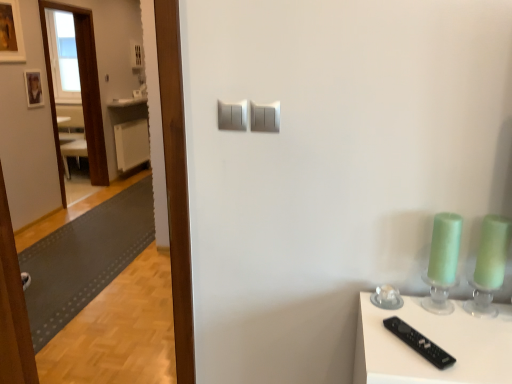
Question: Should I look upward or downward to see wooden picture frame at upper left, the 1th picture frame when ordered from front to back?

Choices:
 (A) down
 (B) up

Answer: (B)

Question: Is white glossy counter top at upper left facing towards transparent wooden door at left?

Choices:
 (A) no
 (B) yes

Answer: (A)

Question: Can you confirm if white glossy counter top at upper left is wider than transparent wooden door at left?

Choices:
 (A) no
 (B) yes

Answer: (A)

Question: From the image's perspective, is white glossy counter top at upper left above transparent wooden door at left?

Choices:
 (A) no
 (B) yes

Answer: (B)

Question: From a real-world perspective, is white glossy counter top at upper left positioned under transparent wooden door at left based on gravity?

Choices:
 (A) no
 (B) yes

Answer: (B)

Question: Does white glossy counter top at upper left have a greater height compared to transparent wooden door at left?

Choices:
 (A) no
 (B) yes

Answer: (A)

Question: Are white glossy counter top at upper left and transparent wooden door at left far apart?

Choices:
 (A) yes
 (B) no

Answer: (B)

Question: Does white plastic radiator at left lie in front of satin silver light switch at upper center, which is the second light switch in right-to-left order?

Choices:
 (A) yes
 (B) no

Answer: (B)

Question: Is white plastic radiator at left facing away from satin silver light switch at upper center, which is the second light switch in right-to-left order?

Choices:
 (A) no
 (B) yes

Answer: (A)

Question: From a real-world perspective, is white plastic radiator at left positioned over satin silver light switch at upper center, the 1th light switch from the left, based on gravity?

Choices:
 (A) no
 (B) yes

Answer: (A)

Question: Is white plastic radiator at left shorter than satin silver light switch at upper center, which is the second light switch in right-to-left order?

Choices:
 (A) yes
 (B) no

Answer: (B)

Question: Is white plastic radiator at left oriented towards satin silver light switch at upper center, the 1th light switch from the left?

Choices:
 (A) yes
 (B) no

Answer: (B)

Question: From the image's perspective, does white plastic radiator at left appear lower than satin silver light switch at upper center, the 1th light switch from the left?

Choices:
 (A) no
 (B) yes

Answer: (A)

Question: Can you confirm if transparent wooden door at left is positioned to the right of wooden picture frame at upper left, placed as the second picture frame when sorted from back to front?

Choices:
 (A) yes
 (B) no

Answer: (A)